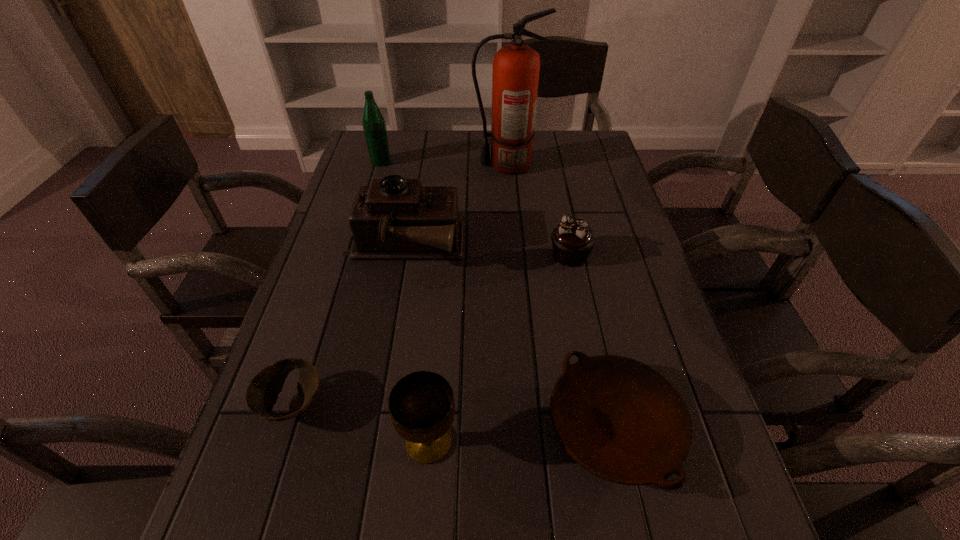
Identify the location of free spot that satisfies the following two spatial constraints: 1. on the nozzle of the tallest object; 2. on the right side of the plate. The height and width of the screenshot is (540, 960). (526, 426).

Identify the location of vacant region that satisfies the following two spatial constraints: 1. on the nozzle of the tallest object; 2. on the right side of the plate. (526, 426).

The height and width of the screenshot is (540, 960). I want to click on vacant space that satisfies the following two spatial constraints: 1. on the horn of the chalice; 2. on the right side of the fifth shortest object, so click(370, 441).